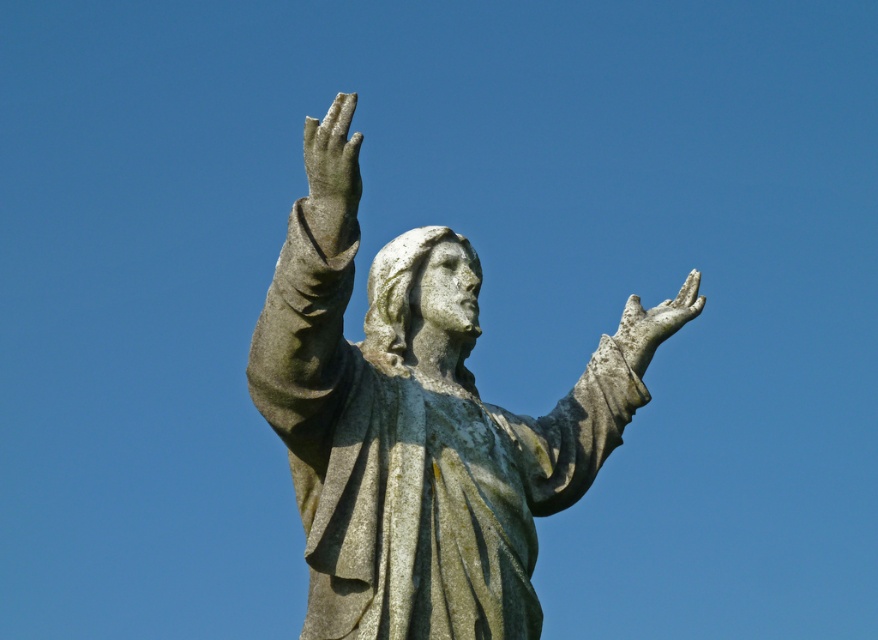
Question: Can you confirm if gray stone statue at center is thinner than gray stone hand at upper right?

Choices:
 (A) no
 (B) yes

Answer: (A)

Question: Estimate the real-world distances between objects in this image. Which object is closer to the gray stone statue at center?

Choices:
 (A) gray stone hand at upper center
 (B) gray stone hand at upper right

Answer: (A)

Question: Which point appears farthest from the camera in this image?

Choices:
 (A) (320, 244)
 (B) (445, 260)

Answer: (B)

Question: Based on their relative distances, which object is nearer to the gray stone hand at upper center?

Choices:
 (A) gray stone hand at upper right
 (B) gray stone statue at center

Answer: (B)

Question: Observing the image, what is the correct spatial positioning of gray stone statue at center in reference to gray stone hand at upper center?

Choices:
 (A) right
 (B) left

Answer: (A)

Question: Can you confirm if gray stone hand at upper center is wider than gray stone hand at upper right?

Choices:
 (A) no
 (B) yes

Answer: (A)